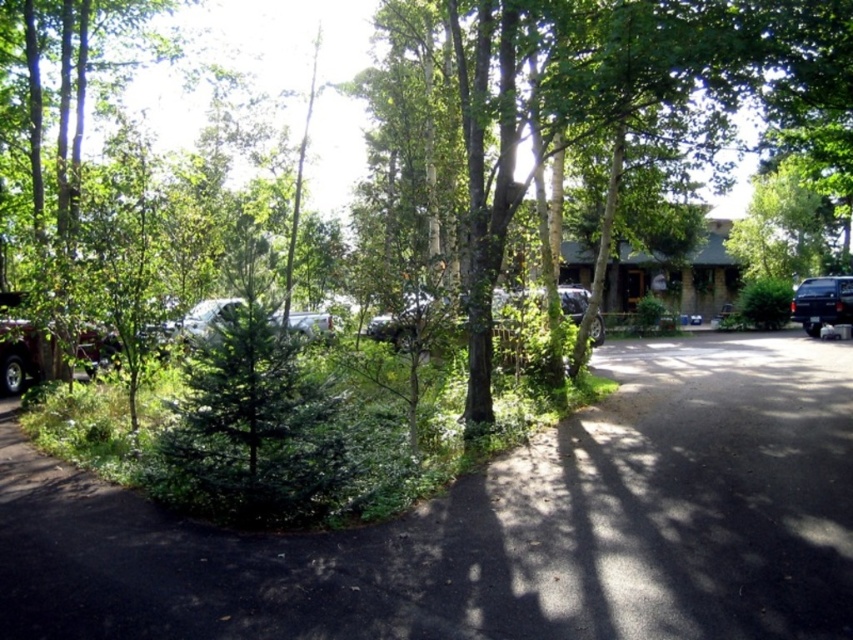
You are standing at the entrance of the driveway and want to reach the building in the background. Which direction should you walk to stay on the dark asphalt driveway at lower center?

The dark asphalt driveway at lower center is located at point (498, 525) in 2D coordinates, so you should walk towards the center of the image to stay on the driveway.

You are standing at the entrance of the residential area and want to reach the dark asphalt driveway at lower center. According to the coordinates provided, where should you head to locate it?

The dark asphalt driveway at lower center is located at point 0.823 on the x axis and 0.586 on the y axis.